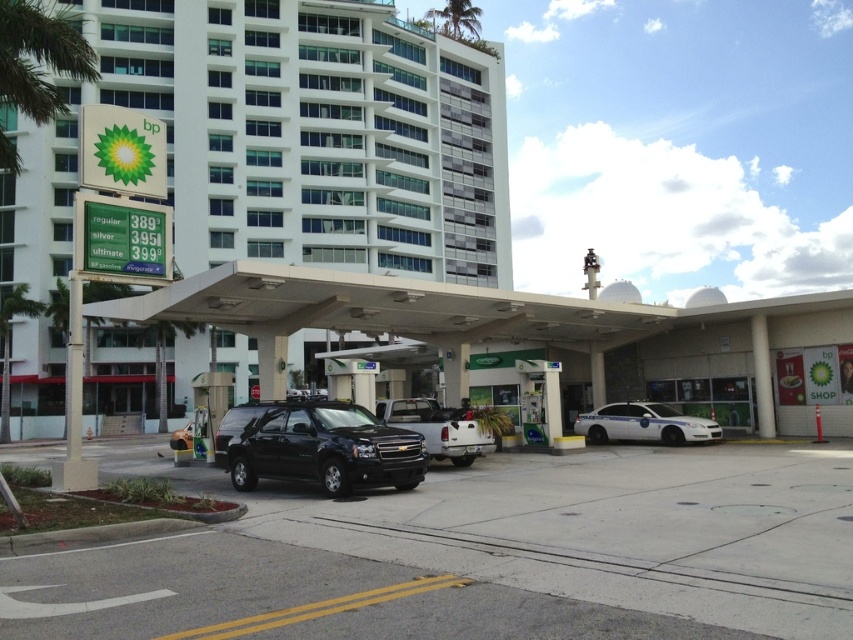
Image resolution: width=853 pixels, height=640 pixels. Find the location of `white glass building at upper center`. white glass building at upper center is located at coordinates (314, 132).

This screenshot has height=640, width=853. Describe the element at coordinates (314, 132) in the screenshot. I see `white glass building at upper center` at that location.

Is point (238, 108) behind point (230, 481)?

That is True.

In order to click on white glass building at upper center in this screenshot , I will do `click(314, 132)`.

Does matte black suv at center appear under green leafy palm tree at left?

Yes.

Describe the element at coordinates (438, 428) in the screenshot. I see `matte black suv at center` at that location.

Locate an element on the screen. The height and width of the screenshot is (640, 853). matte black suv at center is located at coordinates (438, 428).

Between point (115, 20) and point (679, 428), which one is positioned in front?

Positioned in front is point (679, 428).

Between point (210, 10) and point (631, 413), which one is positioned behind?

Point (210, 10)

At what (x,y) coordinates should I click in order to perform the action: click on white glass building at upper center. Please return your answer as a coordinate pair (x, y). This screenshot has height=640, width=853. Looking at the image, I should click on (314, 132).